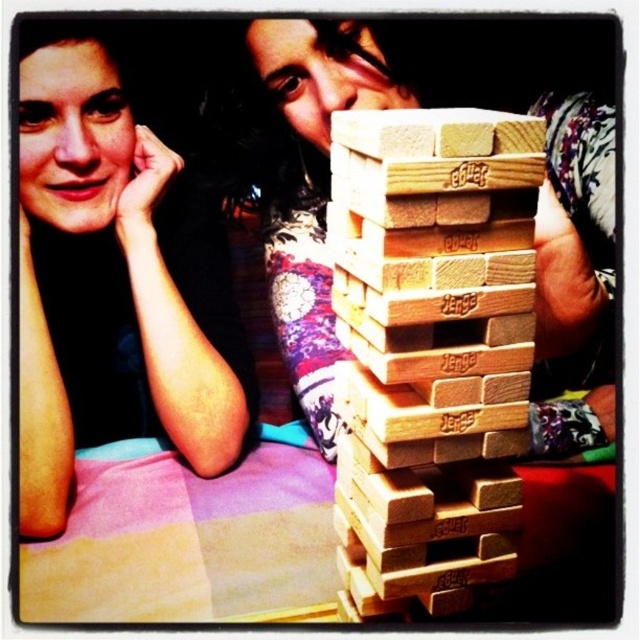
You are observing a Jenga game where two players are focused on the tower. The scene includes natural wood jenga blocks at center and wooden blocks at center. Which of these two objects is smaller in size?

The natural wood jenga blocks at center is smaller than wooden blocks at center according to the description.

What is located at the coordinate point [115,285] in the image?

At the coordinate point [115,285], there is matte black hair at upper left.